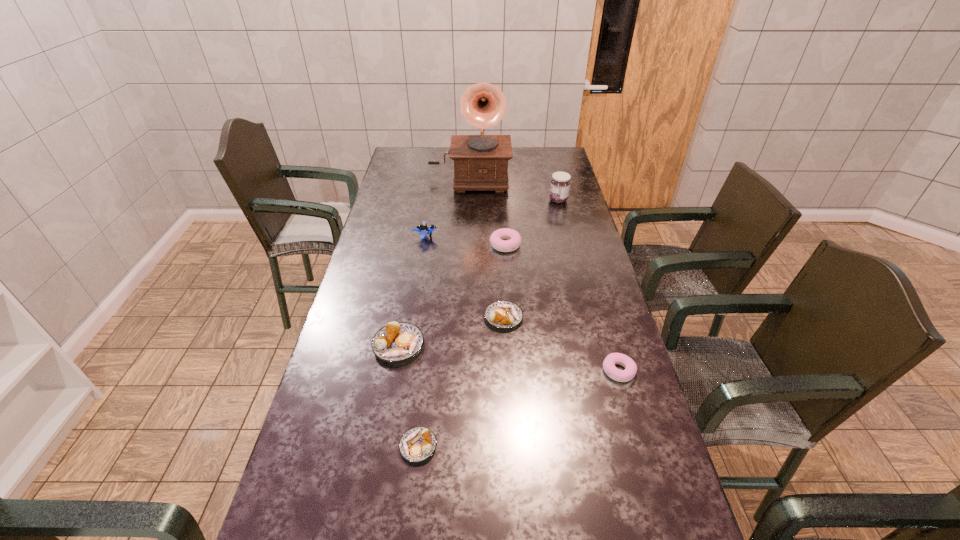
Where is `free area in between the nearest object and the nearer pink pastry`? This screenshot has width=960, height=540. free area in between the nearest object and the nearer pink pastry is located at coordinates (518, 409).

The image size is (960, 540). What are the coordinates of `object that stands as the fifth closest to the tallest object` in the screenshot? It's located at (397, 341).

You are a GUI agent. You are given a task and a screenshot of the screen. Output one action in this format:
    pyautogui.click(x=<x>, y=<y>)
    Task: Click on the seventh closest object to the rightmost pastry
    The width and height of the screenshot is (960, 540).
    Given the screenshot: What is the action you would take?
    pyautogui.click(x=480, y=161)

The height and width of the screenshot is (540, 960). I want to click on the closest pastry to the nearest brown pastry, so click(x=397, y=341).

This screenshot has height=540, width=960. Identify the location of the fifth closest pastry to the brown record player. (417, 444).

Locate which brown pastry ranks second in proximity to the nearer pink pastry. Please provide its 2D coordinates. Your answer should be formatted as a tuple, i.e. [(x, y)], where the tuple contains the x and y coordinates of a point satisfying the conditions above.

[(417, 444)]

I want to click on the closest brown pastry to the jam, so click(x=503, y=314).

I want to click on vacant space that satisfies the following two spatial constraints: 1. on the front-facing side of the Lego; 2. on the back side of the bigger pink pastry, so click(423, 245).

Image resolution: width=960 pixels, height=540 pixels. I want to click on vacant space that satisfies the following two spatial constraints: 1. on the horn of the farthest object; 2. on the front-facing side of the Lego, so click(x=467, y=237).

Find the location of a particular element. vacant space that satisfies the following two spatial constraints: 1. on the front-facing side of the bigger pink pastry; 2. on the right side of the sixth shortest object is located at coordinates (423, 245).